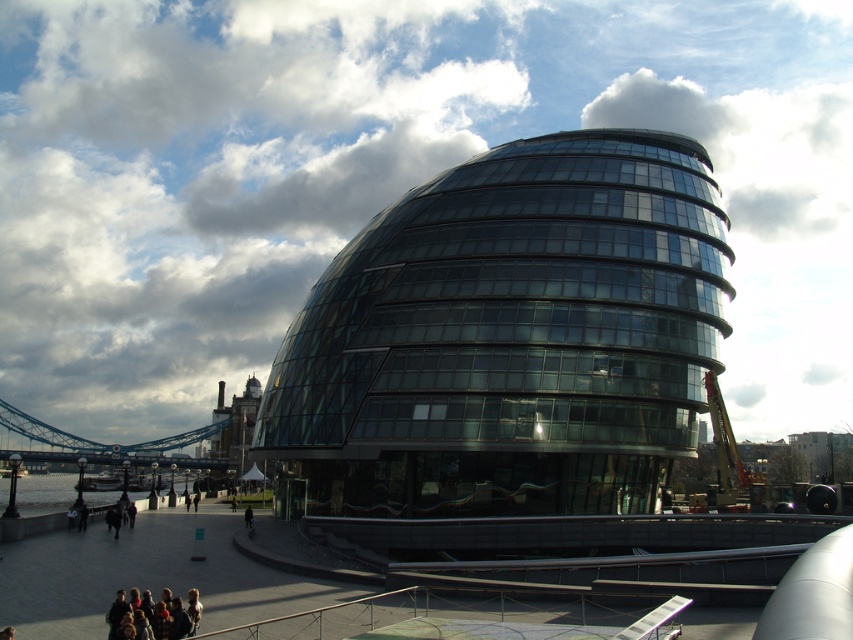
You are standing at the edge of the water body and want to take a photo of the transparent glass dome at center and the dark gray jacket at lower center. Which object should you frame first in your camera viewfinder to ensure both are in the shot?

You should frame the dark gray jacket at lower center first because the transparent glass dome at center is to the right of it, so positioning the jacket first ensures both are included in the shot.

Based on the photo, you are an architect inspecting the construction site. You notice the metallic construction crane at right and the blurred skin people at lower left. Which object is closer to the viewer?

The blurred skin people at lower left are closer to the viewer because the metallic construction crane at right is positioned under them, indicating that the people are in front of the crane.

You are standing at the center of the paved area in the scene. Which object is closer to your right side, the metallic gray suspension bridge at lower left or the metallic construction crane at right?

The metallic construction crane at right is closer to your right side because it is positioned to the right of the metallic gray suspension bridge at lower left.